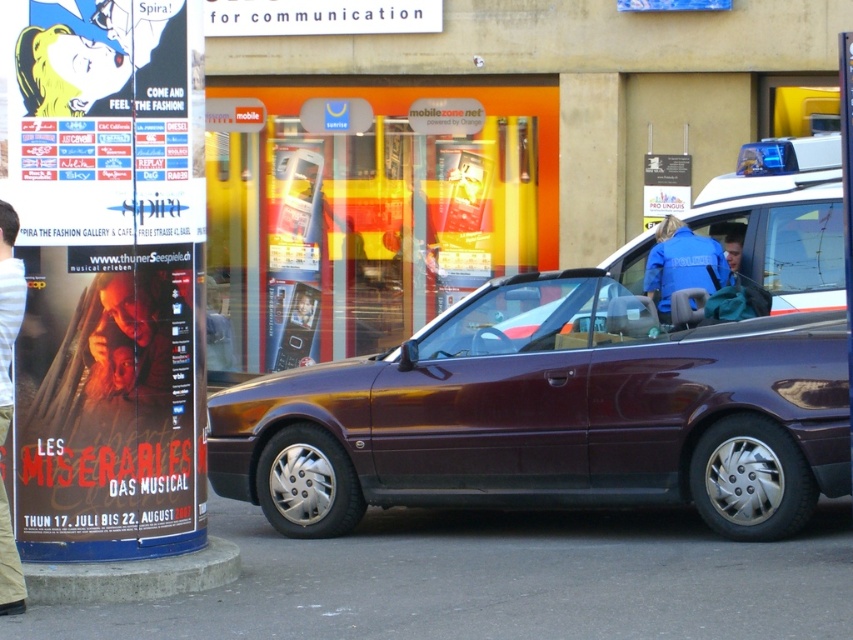
Does concrete at lower left lie behind blue fabric jacket at center?

No, it is in front of blue fabric jacket at center.

Consider the image. Which is above, concrete at lower left or blue fabric jacket at center?

Positioned higher is blue fabric jacket at center.

Is point (129, 593) closer to camera compared to point (666, 225)?

Yes.

Find the location of a particular element. Image resolution: width=853 pixels, height=640 pixels. concrete at lower left is located at coordinates (132, 577).

Between matte paper poster at left and blue fabric jacket at center, which one has more height?

With more height is matte paper poster at left.

Does matte paper poster at left have a smaller size compared to blue fabric jacket at center?

No.

Find the location of a particular element. The height and width of the screenshot is (640, 853). matte paper poster at left is located at coordinates (107, 275).

Which is in front, point (4, 397) or point (650, 264)?

Point (4, 397)

Who is taller, light beige pants at left or blue fabric jacket at center?

light beige pants at left is taller.

Find the location of a particular element. light beige pants at left is located at coordinates (9, 310).